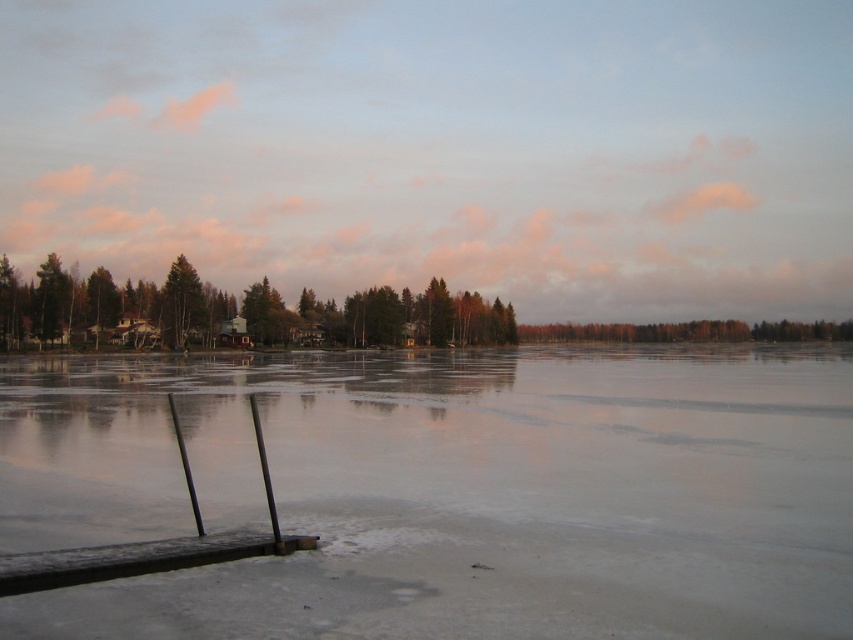
Question: Does transparent ice at center have a larger size compared to brown wooden dock at lower left?

Choices:
 (A) no
 (B) yes

Answer: (B)

Question: Which object appears closest to the camera in this image?

Choices:
 (A) green matte tree at center
 (B) transparent ice at center

Answer: (B)

Question: Among these objects, which one is nearest to the camera?

Choices:
 (A) transparent ice at center
 (B) green matte tree at center

Answer: (A)

Question: Which of the following is the closest to the observer?

Choices:
 (A) (1, 588)
 (B) (64, 364)

Answer: (A)

Question: Does transparent ice at center have a greater width compared to brown wooden dock at lower left?

Choices:
 (A) yes
 (B) no

Answer: (A)

Question: Can you confirm if transparent ice at center is positioned above brown wooden dock at lower left?

Choices:
 (A) yes
 (B) no

Answer: (B)